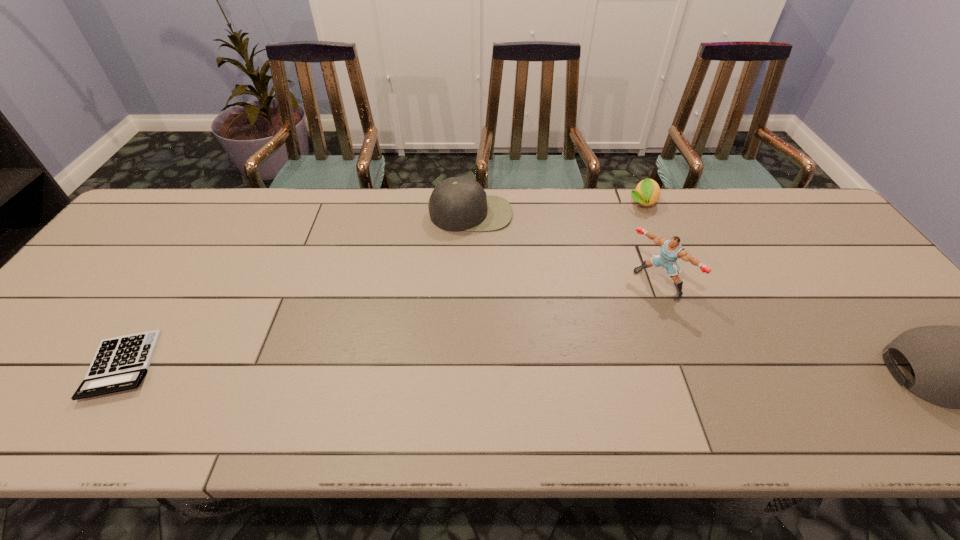
Find the location of a particular element. Image resolution: width=960 pixels, height=540 pixels. the shortest object is located at coordinates click(x=120, y=363).

The width and height of the screenshot is (960, 540). I want to click on calculator, so [120, 363].

This screenshot has height=540, width=960. What are the coordinates of `puncher` in the screenshot? It's located at (671, 250).

Where is `the third nearest object`? This screenshot has height=540, width=960. the third nearest object is located at coordinates (671, 250).

The height and width of the screenshot is (540, 960). What are the coordinates of `the fourth tallest object` in the screenshot? It's located at (647, 192).

You are a GUI agent. You are given a task and a screenshot of the screen. Output one action in this format:
    pyautogui.click(x=<x>, y=<y>)
    Task: Click on the cap
    Image resolution: width=960 pixels, height=540 pixels.
    Given the screenshot: What is the action you would take?
    pyautogui.click(x=457, y=203)

Where is `vacant space located 0.100m on the left of the shortest object`? The width and height of the screenshot is (960, 540). vacant space located 0.100m on the left of the shortest object is located at coordinates (41, 366).

Locate an element on the screen. Image resolution: width=960 pixels, height=540 pixels. free space located on the front-facing side of the third nearest object is located at coordinates (608, 326).

Where is `blank space located on the front-facing side of the third nearest object`? Image resolution: width=960 pixels, height=540 pixels. blank space located on the front-facing side of the third nearest object is located at coordinates (631, 307).

Image resolution: width=960 pixels, height=540 pixels. Find the location of `free space located 0.340m on the front-facing side of the third nearest object`. free space located 0.340m on the front-facing side of the third nearest object is located at coordinates (550, 372).